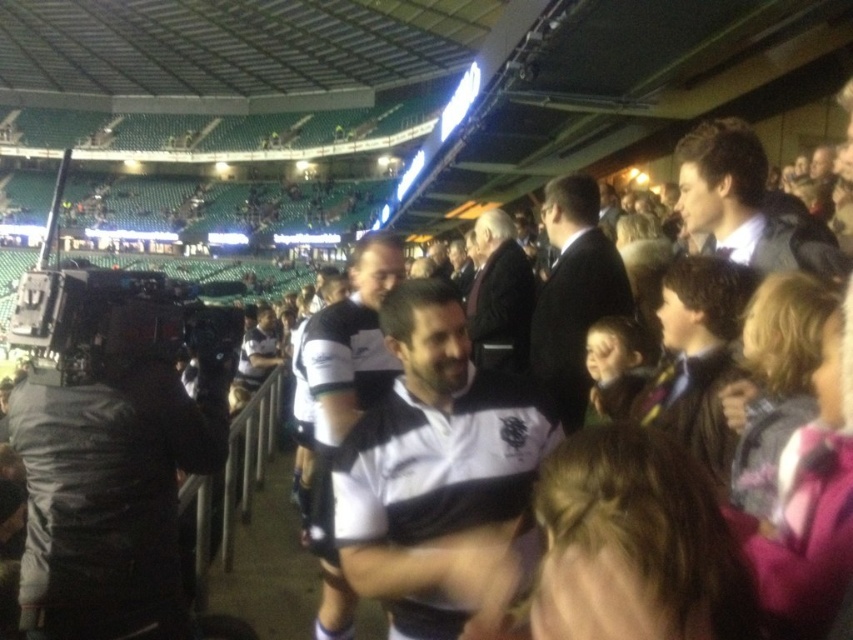
You are a photographer at the stadium event. You need to capture a photo where the brown hair at right and dark suit at center are both visible. Given their heights, which one might appear closer to the camera if you position yourself at the same level as their heads?

The brown hair at right is shorter than the dark suit at center, so if positioned at the same head level, the dark suit at center would appear closer to the camera because it is taller and its head would be nearer to the lens.

You are a photographer positioned at the back of the stadium and want to capture both the white jersey at center and the dark brown suit at center in a single photo. Based on their sizes in the image, which one will appear taller in the photo?

The white jersey at center will appear taller in the photo because it has a greater height compared to the dark brown suit at center as described.